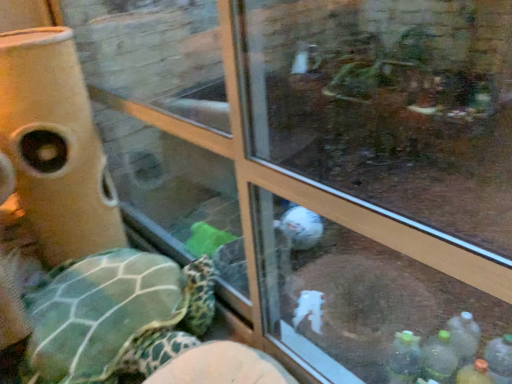
What do you see at coordinates (116, 317) in the screenshot? I see `green textured shell at left` at bounding box center [116, 317].

The width and height of the screenshot is (512, 384). Identify the location of green textured shell at left. (x=116, y=317).

This screenshot has width=512, height=384. Find the location of `green textured shell at left`. green textured shell at left is located at coordinates (116, 317).